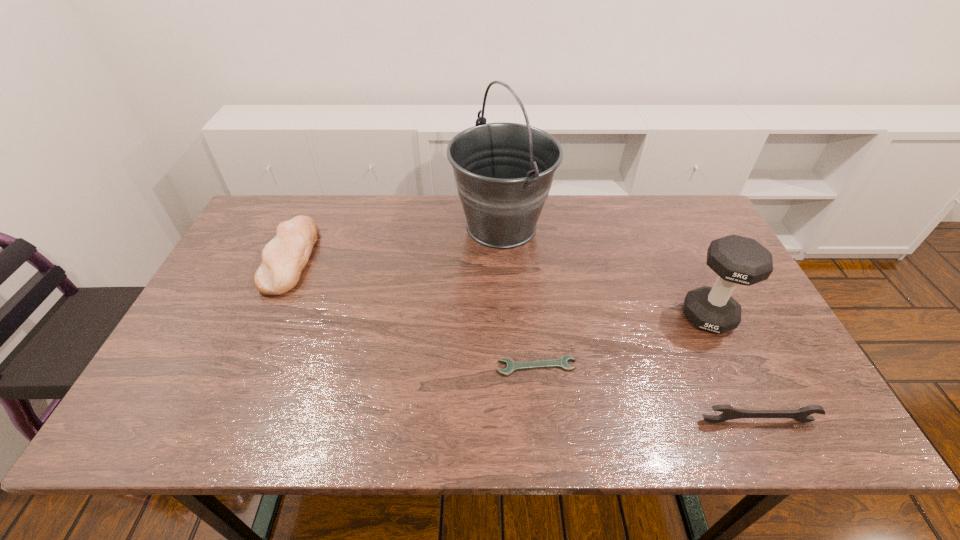
The width and height of the screenshot is (960, 540). In the image, there is a desktop. In order to click on vacant space at the far edge in this screenshot , I will do `click(618, 197)`.

What are the coordinates of `vacant space at the near edge of the desktop` in the screenshot? It's located at (505, 406).

This screenshot has width=960, height=540. What are the coordinates of `vacant region at the left edge` in the screenshot? It's located at (252, 241).

Find the location of a particular element. This screenshot has width=960, height=540. vacant space at the far right corner is located at coordinates (696, 227).

Find the location of a particular element. vacant area between the tallest object and the third tallest object is located at coordinates (396, 242).

This screenshot has height=540, width=960. What are the coordinates of `free space between the taller wrench and the dumbbell` in the screenshot? It's located at (732, 369).

The image size is (960, 540). Find the location of `free space that is in between the second nearest object and the bucket`. free space that is in between the second nearest object and the bucket is located at coordinates (518, 296).

Find the location of a particular element. This screenshot has height=540, width=960. empty location between the bucket and the second nearest object is located at coordinates (518, 296).

The image size is (960, 540). I want to click on free area in between the right wrench and the leftmost object, so click(524, 339).

Locate an element on the screen. free space between the nearest object and the leftmost object is located at coordinates (524, 339).